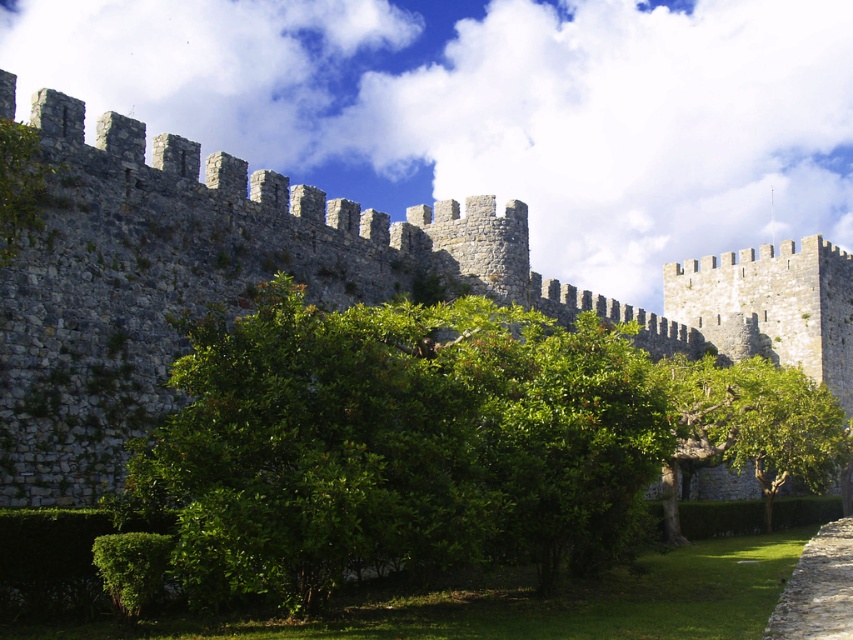
Looking at this image, you are standing in a medieval garden and see the gray stone wall at center and the green leafy hedge at lower left. Which object is positioned to the right of the other?

The gray stone wall at center is to the right of the green leafy hedge at lower left.

You are standing at the base of the medieval stone wall and see two points marked on the wall. One is labeled as point (515, 244) and the other as point (821, 554). Which point is closer to you?

Point (821, 554) is closer to you because point (515, 244) is behind it.